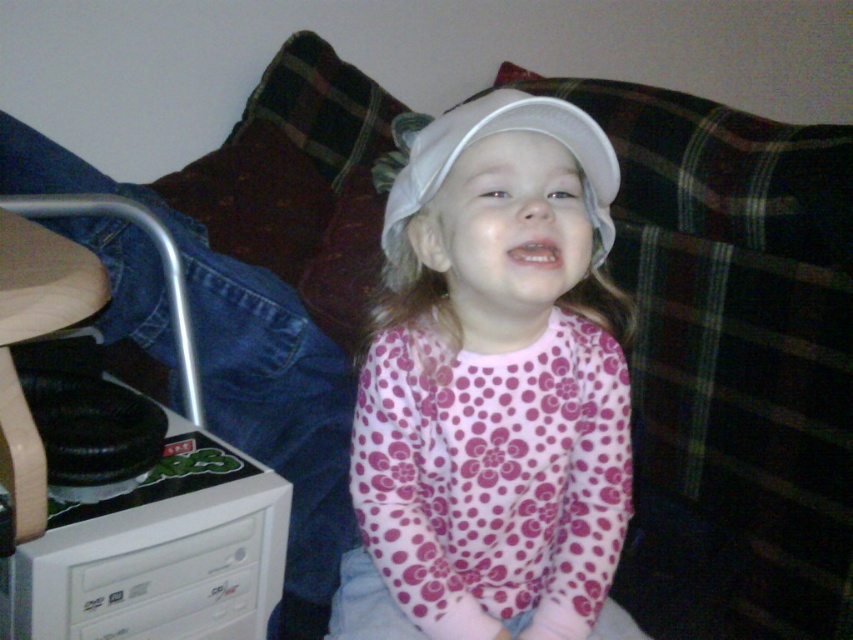
Is white matte cap at center to the right of white plastic drawer at lower left from the viewer's perspective?

Correct, you'll find white matte cap at center to the right of white plastic drawer at lower left.

Is point (581, 292) closer to camera compared to point (132, 561)?

No, (581, 292) is behind (132, 561).

Is point (534, 596) positioned after point (247, 628)?

Yes, it is behind point (247, 628).

This screenshot has width=853, height=640. In order to click on white matte cap at center in this screenshot , I will do `click(492, 388)`.

Which is in front, point (578, 202) or point (471, 140)?

Point (471, 140) is more forward.

Is white matte cap at center taller than white matte baseball hat at center?

Indeed, white matte cap at center has a greater height compared to white matte baseball hat at center.

The image size is (853, 640). What do you see at coordinates (492, 388) in the screenshot?
I see `white matte cap at center` at bounding box center [492, 388].

Where is `white matte cap at center`? white matte cap at center is located at coordinates (492, 388).

Does white plastic drawer at lower left appear on the left side of white matte baseball hat at center?

Correct, you'll find white plastic drawer at lower left to the left of white matte baseball hat at center.

Can you confirm if white plastic drawer at lower left is smaller than white matte baseball hat at center?

Yes.

Is point (109, 572) more distant than point (453, 108)?

No, it is in front of (453, 108).

The height and width of the screenshot is (640, 853). In order to click on white plastic drawer at lower left in this screenshot , I will do `click(175, 588)`.